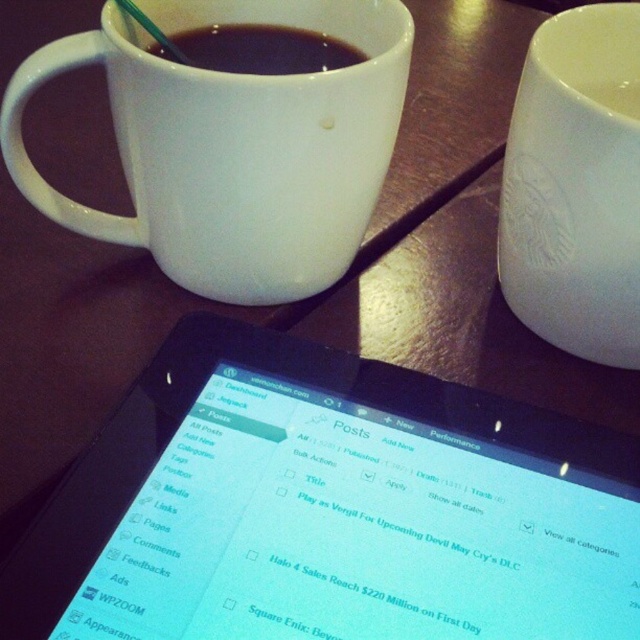
The width and height of the screenshot is (640, 640). What do you see at coordinates (234, 145) in the screenshot?
I see `white glossy mug at upper center` at bounding box center [234, 145].

In the scene shown: Who is more distant from viewer, (387, 131) or (195, 54)?

The point (195, 54) is more distant.

What are the coordinates of `white glossy mug at upper center` in the screenshot? It's located at (234, 145).

Is white ceramic mug at upper right smaller than matte white cup at upper center?

No, white ceramic mug at upper right is not smaller than matte white cup at upper center.

Which is more to the left, white ceramic mug at upper right or matte white cup at upper center?

Positioned to the left is matte white cup at upper center.

Between point (561, 196) and point (246, 29), which one is positioned in front?

Positioned in front is point (561, 196).

You are a GUI agent. You are given a task and a screenshot of the screen. Output one action in this format:
    pyautogui.click(x=<x>, y=<y>)
    Task: Click on the white ceramic mug at upper right
    This screenshot has width=640, height=640.
    Given the screenshot: What is the action you would take?
    pyautogui.click(x=576, y=186)

Can you confirm if black glossy tablet at center is smaller than matte white cup at upper center?

Actually, black glossy tablet at center might be larger than matte white cup at upper center.

Can you confirm if black glossy tablet at center is thinner than matte white cup at upper center?

No.

Who is more distant from viewer, (84, 515) or (280, 70)?

The point (280, 70) is more distant.

Identify the location of black glossy tablet at center. The width and height of the screenshot is (640, 640). (328, 508).